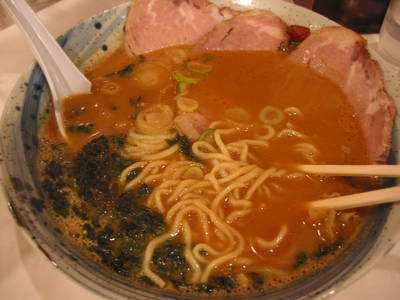
Locate an element on the screen. This screenshot has height=300, width=400. chopsticks is located at coordinates (363, 199), (349, 170).